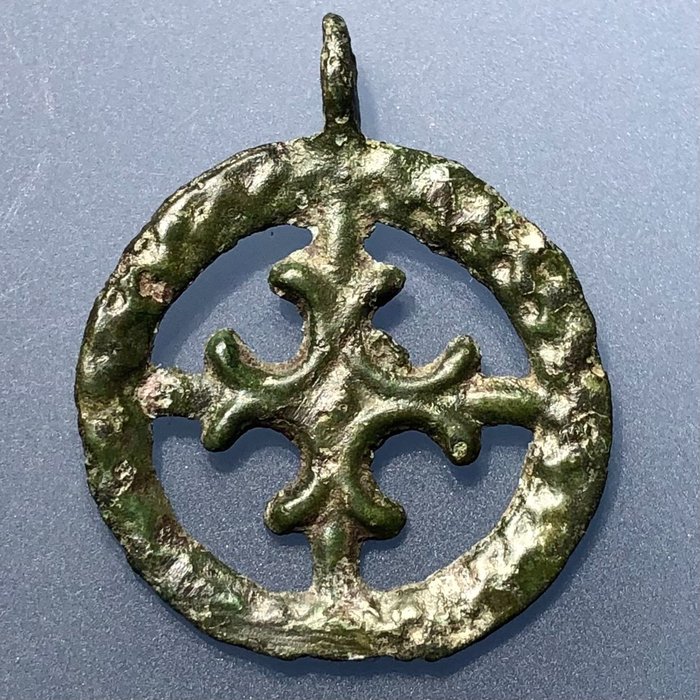
At what (x,y) coordinates should I click in order to perform the action: click on bar. Please return your answer as a coordinate pair (x, y). Looking at the image, I should click on (518, 416).